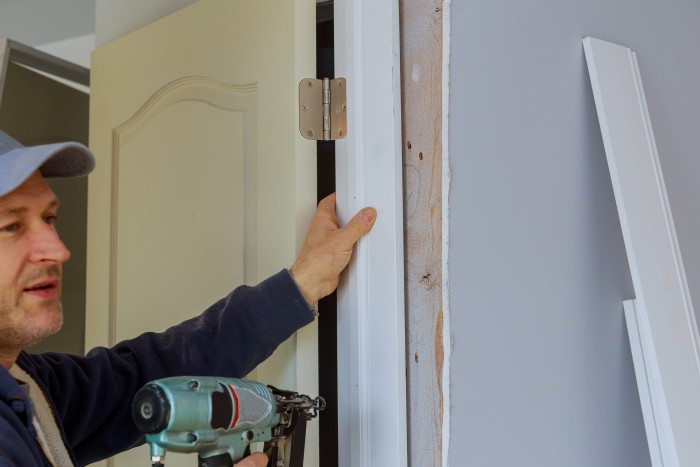
Find the location of a particular element. beige door is located at coordinates (197, 158).